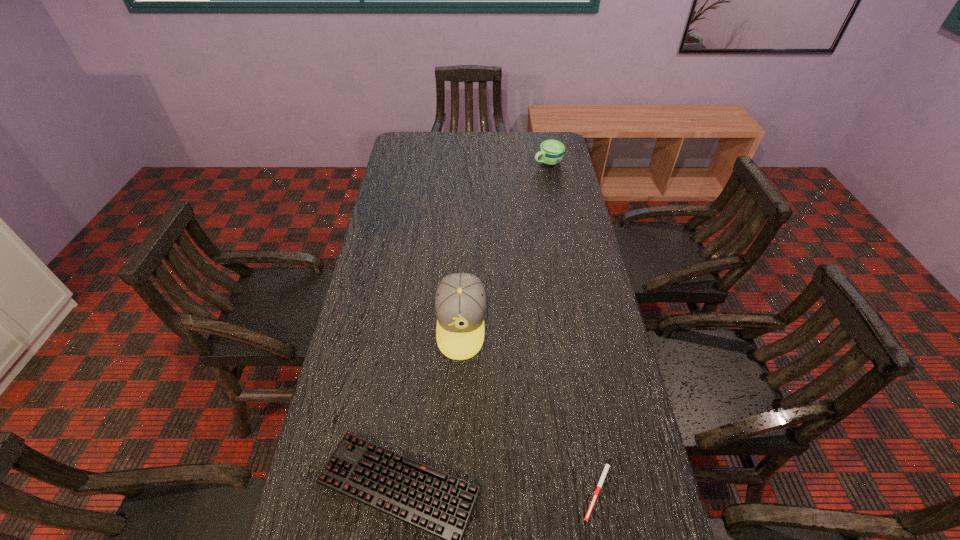
The width and height of the screenshot is (960, 540). Find the location of `baseball cap`. baseball cap is located at coordinates (460, 302).

Identify the location of the tallest object. (460, 302).

Locate an element on the screen. This screenshot has width=960, height=540. the farthest object is located at coordinates (551, 152).

At what (x,y) coordinates should I click in order to perform the action: click on the second tallest object. Please return your answer as a coordinate pair (x, y). This screenshot has width=960, height=540. Looking at the image, I should click on (551, 152).

You are a GUI agent. You are given a task and a screenshot of the screen. Output one action in this format:
    pyautogui.click(x=<x>, y=<y>)
    Task: Click on the pen
    
    Given the screenshot: What is the action you would take?
    pyautogui.click(x=606, y=468)

Locate an element on the screen. The height and width of the screenshot is (540, 960). free space located on the front-facing side of the tallest object is located at coordinates (457, 448).

Locate an element on the screen. This screenshot has height=540, width=960. free space located 0.360m on the front of the second tallest object is located at coordinates point(560,224).

Image resolution: width=960 pixels, height=540 pixels. Find the location of `object that is at the far edge`. object that is at the far edge is located at coordinates (551, 152).

The width and height of the screenshot is (960, 540). In order to click on cup at the right edge in this screenshot , I will do `click(551, 152)`.

This screenshot has width=960, height=540. In order to click on pen that is at the right edge in this screenshot , I will do `click(606, 468)`.